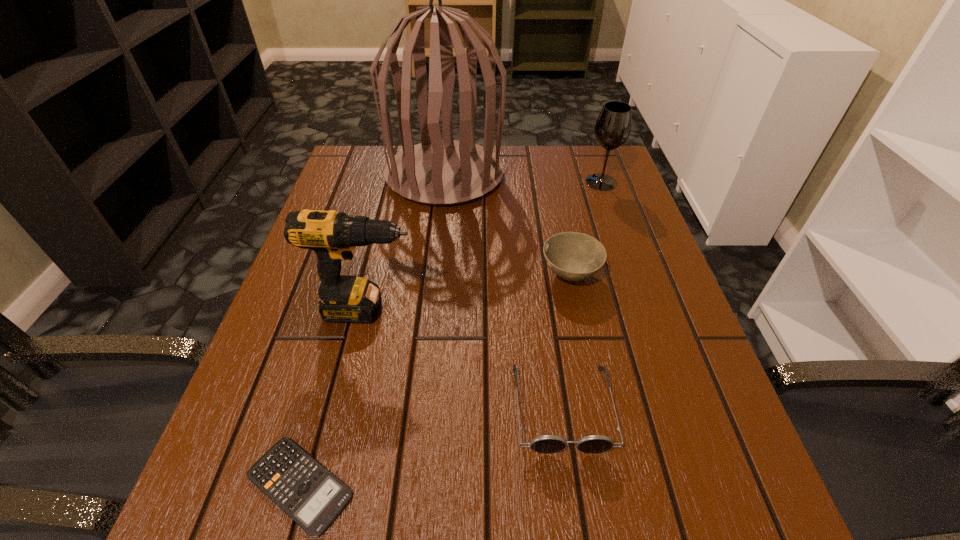
Locate an element on the screen. object that is at the far left corner is located at coordinates (437, 172).

This screenshot has width=960, height=540. Identify the location of object that is at the near left corner. (306, 491).

Identify the location of object located in the far right corner section of the desktop. (613, 127).

The height and width of the screenshot is (540, 960). Find the location of `vacant space at the far edge of the desktop`. vacant space at the far edge of the desktop is located at coordinates (508, 159).

In the image, there is a desktop. Where is `free region at the left edge`? free region at the left edge is located at coordinates (275, 400).

In the image, there is a desktop. Where is `free space at the right edge`? This screenshot has height=540, width=960. free space at the right edge is located at coordinates (612, 216).

You are a GUI agent. You are given a task and a screenshot of the screen. Output one action in this format:
    pyautogui.click(x=<x>, y=<y>)
    Task: Click on the free space at the far left corner of the desktop
    
    Given the screenshot: What is the action you would take?
    pyautogui.click(x=358, y=151)

You are a GUI agent. You are given a task and a screenshot of the screen. Output one action in this format:
    pyautogui.click(x=<x>, y=<y>)
    Task: Click on the free spot between the drill and the calculator
    The width and height of the screenshot is (960, 540).
    Given the screenshot: What is the action you would take?
    pyautogui.click(x=334, y=397)

You are a GUI agent. You are given a task and a screenshot of the screen. Output one action in this format:
    pyautogui.click(x=<x>, y=<y>)
    Task: Click on the vacant space that's between the wineglass and the drill
    The width and height of the screenshot is (960, 540).
    Given the screenshot: What is the action you would take?
    pyautogui.click(x=485, y=246)

Where is `unoccupied position between the drill and the bowl`? This screenshot has height=540, width=960. unoccupied position between the drill and the bowl is located at coordinates (469, 292).